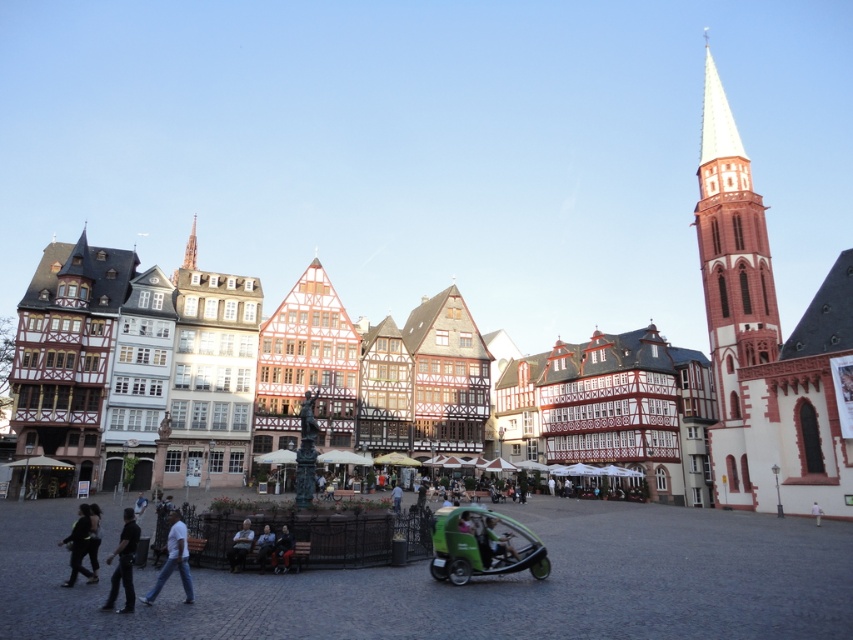
Question: Does white cotton shirt at lower left have a lesser width compared to light brown wooden bench at lower center?

Choices:
 (A) yes
 (B) no

Answer: (B)

Question: Which of these objects is positioned farthest from the dark gray fabric jacket at lower center?

Choices:
 (A) dark green fabric jacket at lower left
 (B) white stone tower at upper right
 (C) green fabric cart at center

Answer: (B)

Question: Among these objects, which one is farthest from the camera?

Choices:
 (A) dark gray pants at lower left
 (B) dark gray fabric jacket at lower center
 (C) green fabric cart at center
 (D) dark blue jeans at center

Answer: (B)

Question: Which is nearer to the white cotton shirt at lower left?

Choices:
 (A) dark blue jeans at center
 (B) green matte tricycle at lower center
 (C) light brown wooden bench at lower center

Answer: (A)

Question: Can you confirm if white stone tower at upper right is smaller than dark blue jeans at center?

Choices:
 (A) yes
 (B) no

Answer: (B)

Question: Considering the relative positions of dark green fabric jacket at lower left and dark gray fabric jacket at lower center in the image provided, where is dark green fabric jacket at lower left located with respect to dark gray fabric jacket at lower center?

Choices:
 (A) above
 (B) below

Answer: (B)